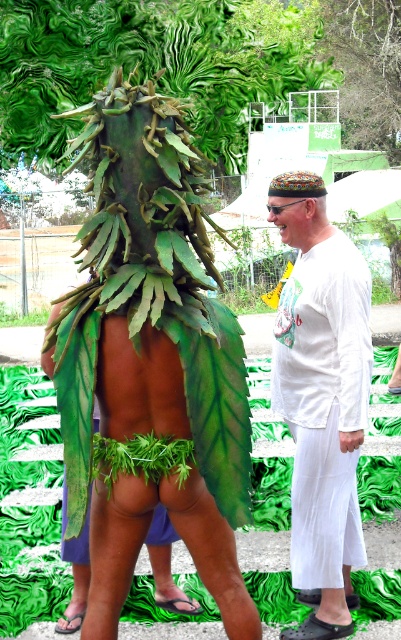
Question: Does white satin shirt at center have a smaller size compared to green leafy costume at center?

Choices:
 (A) no
 (B) yes

Answer: (A)

Question: Which point appears farthest from the camera in this image?

Choices:
 (A) (16, 324)
 (B) (356, 337)

Answer: (A)

Question: Does white satin shirt at center appear on the left side of multicolored woven hat at center?

Choices:
 (A) yes
 (B) no

Answer: (B)

Question: Among these points, which one is farthest from the camera?

Choices:
 (A) (273, 209)
 (B) (299, 556)
 (C) (42, 321)

Answer: (C)

Question: Does white satin shirt at center appear on the right side of green leafy costume at center?

Choices:
 (A) yes
 (B) no

Answer: (A)

Question: Which point is closer to the camera?

Choices:
 (A) white satin shirt at center
 (B) green leafy costume at center
 (C) multicolored woven hat at center

Answer: (A)